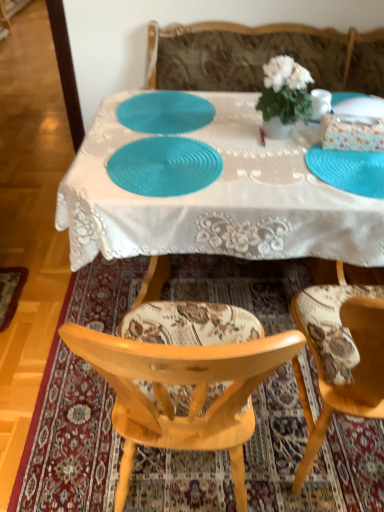
Where is `vacant space that's between blue textured placemat at center, the 1th plate positioned from the left, and teal textured plate at center, acting as the second plate starting from the right`? The height and width of the screenshot is (512, 384). vacant space that's between blue textured placemat at center, the 1th plate positioned from the left, and teal textured plate at center, acting as the second plate starting from the right is located at coordinates (178, 134).